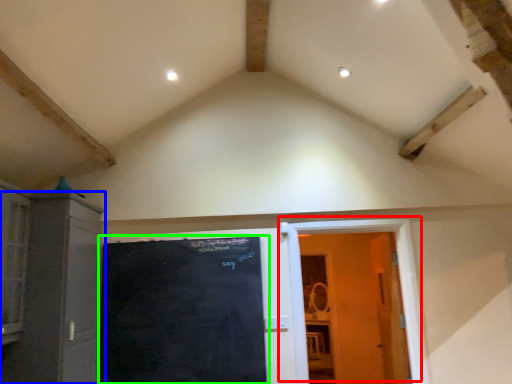
Question: Considering the real-world distances, which object is farthest from door (highlighted by a red box)? cabinetry (highlighted by a blue box) or bulletin board (highlighted by a green box)?

Choices:
 (A) cabinetry
 (B) bulletin board

Answer: (A)